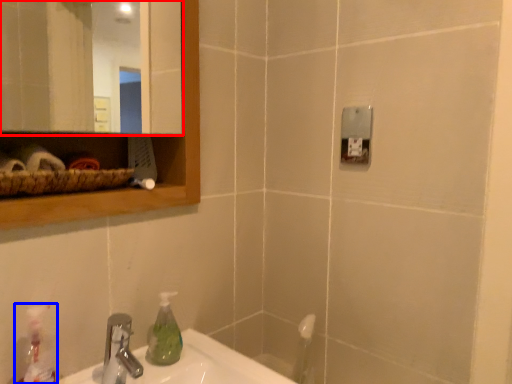
Question: Which object is further to the camera taking this photo, mirror (highlighted by a red box) or cleaning product (highlighted by a blue box)?

Choices:
 (A) mirror
 (B) cleaning product

Answer: (B)